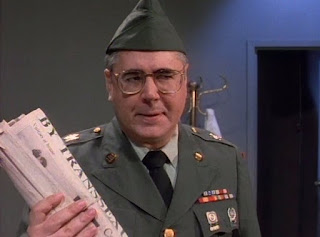
Find the location of a particular element. newspaper is located at coordinates (59, 154).